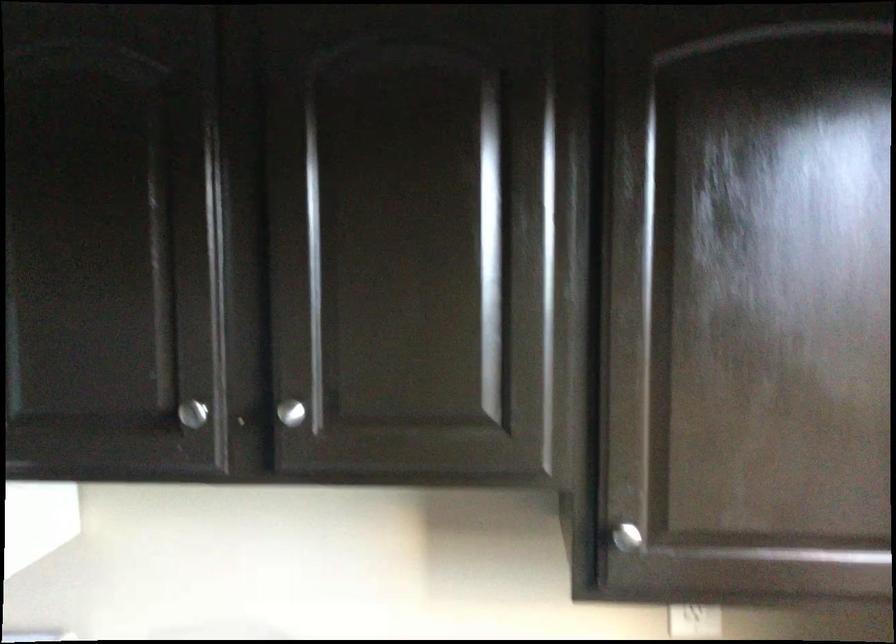
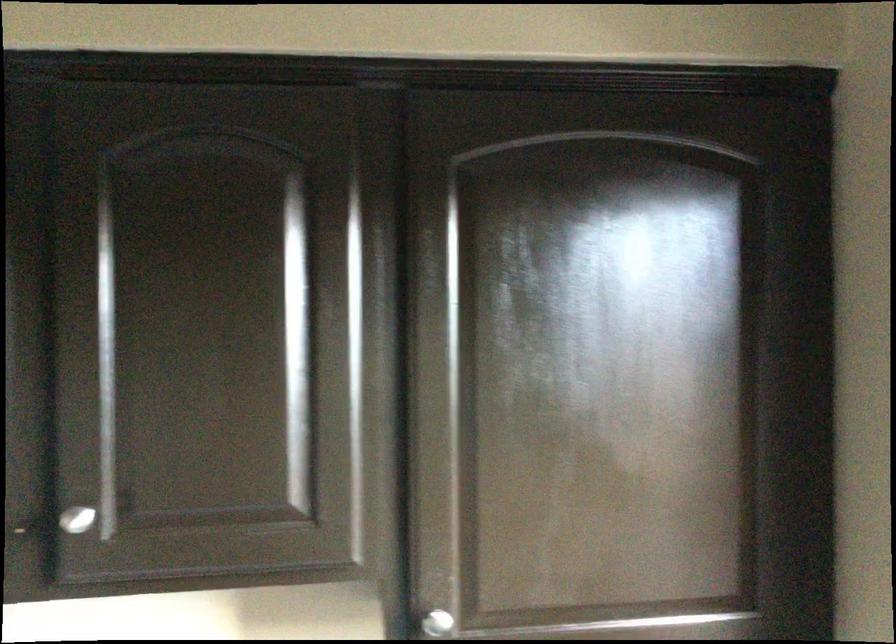
Question: What movement of the cameraman would produce the second image?

Choices:
 (A) Left
 (B) Right
 (C) Forward
 (D) Backward

Answer: (B)